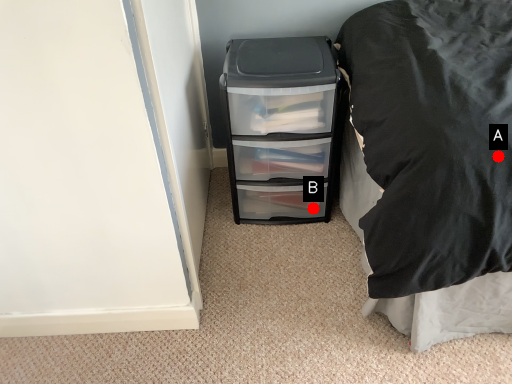
Question: Two points are circled on the image, labeled by A and B beside each circle. Which point is closer to the camera taking this photo?

Choices:
 (A) A is closer
 (B) B is closer

Answer: (A)